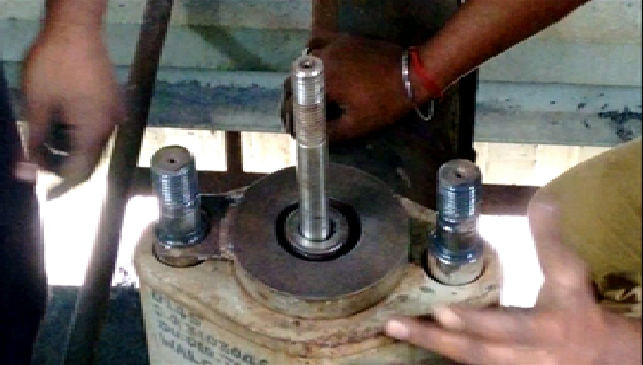
Locate an element on the screen. The height and width of the screenshot is (365, 643). blue paint on wall is located at coordinates (188, 103).